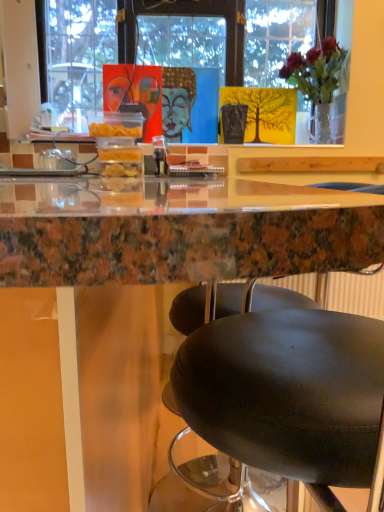
Question: Are translucent glass vase at upper right and marble table at center located far from each other?

Choices:
 (A) yes
 (B) no

Answer: (A)

Question: Is translucent glass vase at upper right shorter than marble table at center?

Choices:
 (A) yes
 (B) no

Answer: (A)

Question: Is translucent glass vase at upper right taller than marble table at center?

Choices:
 (A) no
 (B) yes

Answer: (A)

Question: From a real-world perspective, is translucent glass vase at upper right located higher than marble table at center?

Choices:
 (A) yes
 (B) no

Answer: (A)

Question: Are translucent glass vase at upper right and marble table at center making contact?

Choices:
 (A) no
 (B) yes

Answer: (A)

Question: Is translucent glass vase at upper right further to camera compared to marble table at center?

Choices:
 (A) no
 (B) yes

Answer: (B)

Question: Does marble table at center have a greater width compared to translucent glass vase at upper right?

Choices:
 (A) yes
 (B) no

Answer: (A)

Question: Does marble table at center come in front of translucent glass vase at upper right?

Choices:
 (A) yes
 (B) no

Answer: (A)

Question: Considering the relative sizes of marble table at center and translucent glass vase at upper right in the image provided, is marble table at center thinner than translucent glass vase at upper right?

Choices:
 (A) no
 (B) yes

Answer: (A)

Question: Can you confirm if marble table at center is taller than translucent glass vase at upper right?

Choices:
 (A) yes
 (B) no

Answer: (A)

Question: From the image's perspective, does marble table at center appear lower than translucent glass vase at upper right?

Choices:
 (A) yes
 (B) no

Answer: (A)

Question: Considering the relative sizes of marble table at center and translucent glass vase at upper right in the image provided, is marble table at center shorter than translucent glass vase at upper right?

Choices:
 (A) no
 (B) yes

Answer: (A)

Question: Considering their positions, is marble table at center located in front of or behind translucent glass vase at upper right?

Choices:
 (A) front
 (B) behind

Answer: (A)